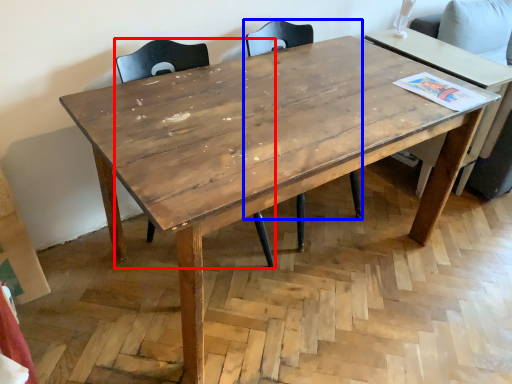
Question: Which point is further to the camera, chair (highlighted by a red box) or chair (highlighted by a blue box)?

Choices:
 (A) chair
 (B) chair

Answer: (B)